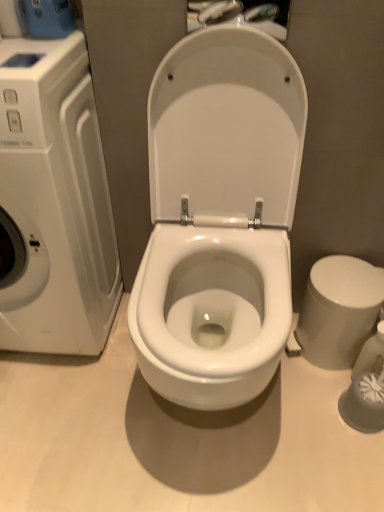
Question: From the image's perspective, is white glossy washing machine at left located above white glossy bidet at right?

Choices:
 (A) no
 (B) yes

Answer: (B)

Question: Is white glossy washing machine at left shorter than white glossy bidet at right?

Choices:
 (A) yes
 (B) no

Answer: (B)

Question: Is white glossy washing machine at left thinner than white glossy bidet at right?

Choices:
 (A) no
 (B) yes

Answer: (A)

Question: From the image's perspective, does white glossy washing machine at left appear lower than white glossy bidet at right?

Choices:
 (A) no
 (B) yes

Answer: (A)

Question: Is white glossy washing machine at left turned away from white glossy bidet at right?

Choices:
 (A) no
 (B) yes

Answer: (A)

Question: Would you say white glossy bidet at right is part of white glossy washing machine at left's contents?

Choices:
 (A) yes
 (B) no

Answer: (B)

Question: Does white glossy bidet at right have a greater width compared to white glossy washing machine at left?

Choices:
 (A) no
 (B) yes

Answer: (A)

Question: From the image's perspective, is white glossy bidet at right below white glossy washing machine at left?

Choices:
 (A) yes
 (B) no

Answer: (A)

Question: Considering the relative sizes of white glossy bidet at right and white glossy washing machine at left in the image provided, is white glossy bidet at right smaller than white glossy washing machine at left?

Choices:
 (A) no
 (B) yes

Answer: (B)

Question: Is white glossy bidet at right shorter than white glossy washing machine at left?

Choices:
 (A) yes
 (B) no

Answer: (A)

Question: Is white glossy bidet at right turned away from white glossy washing machine at left?

Choices:
 (A) no
 (B) yes

Answer: (A)

Question: Is white glossy bidet at right taller than white glossy washing machine at left?

Choices:
 (A) no
 (B) yes

Answer: (A)

Question: In the image, is white glossy washing machine at left positioned in front of or behind white glossy bidet at right?

Choices:
 (A) front
 (B) behind

Answer: (A)